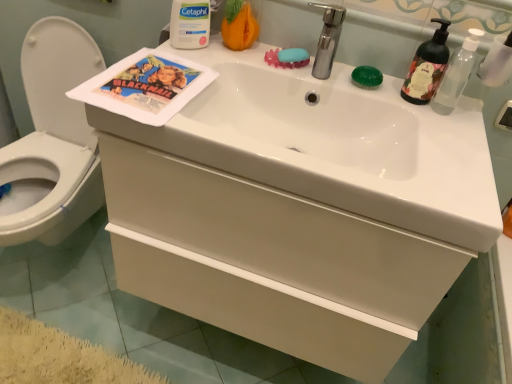
The width and height of the screenshot is (512, 384). I want to click on free location to the right of silver metallic faucet at upper center, so click(370, 91).